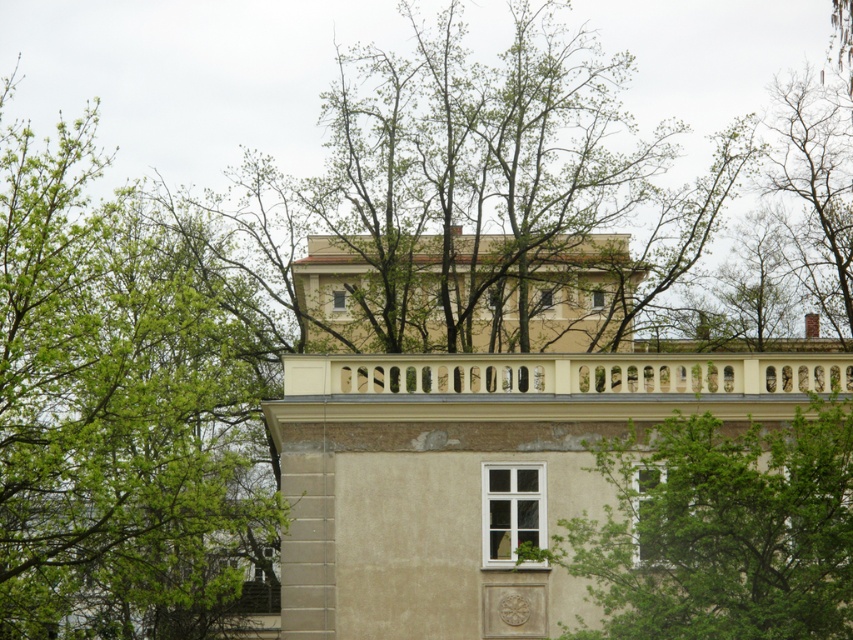
You are a maintenance worker needing to reach the beige stone balcony at upper center from the green leafy tree at upper left. Given that your ladder can extend up to 10 meters, will it be sufficient?

The distance between the green leafy tree at upper left and the beige stone balcony at upper center is 9.82 meters, so the ladder can be extended to 10 meters, which is sufficient to reach the balcony.

You are standing at the base of the building and want to estimate how far the beige stone balcony at upper center is from you. Based on the information provided, what is the approximate distance in feet?

The beige stone balcony at upper center is approximately 288.93 feet away from the viewer.

You are a window washer standing on the beige stone balcony at upper center. You notice the green leafy tree at upper left. Which object is closer to the building facade?

The beige stone balcony at upper center is part of the building facade, so it is closer to the building facade than the green leafy tree at upper left.